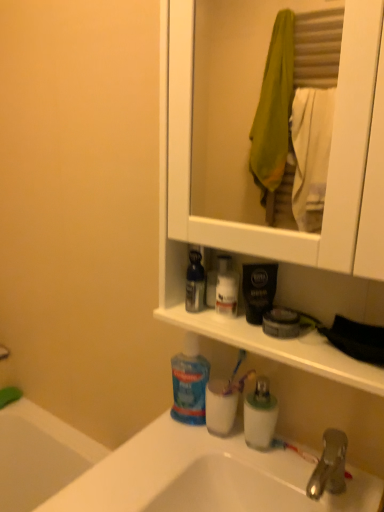
Question: Is blue glossy mouthwash at center, the second mouthwash viewed from the right, surrounded by white matte cabinet at upper center?

Choices:
 (A) no
 (B) yes

Answer: (B)

Question: Would you say white matte cabinet at upper center is outside blue glossy mouthwash at center, acting as the 2th mouthwash starting from the bottom?

Choices:
 (A) yes
 (B) no

Answer: (A)

Question: Is white matte cabinet at upper center next to blue glossy mouthwash at center, acting as the 2th mouthwash starting from the bottom?

Choices:
 (A) yes
 (B) no

Answer: (B)

Question: Does white matte cabinet at upper center have a lesser width compared to blue glossy mouthwash at center, acting as the 2th mouthwash starting from the bottom?

Choices:
 (A) yes
 (B) no

Answer: (B)

Question: From the image's perspective, is white matte cabinet at upper center above blue glossy mouthwash at center, placed as the first mouthwash when sorted from left to right?

Choices:
 (A) yes
 (B) no

Answer: (A)

Question: Is white matte cabinet at upper center at the left side of blue glossy mouthwash at center, the second mouthwash viewed from the right?

Choices:
 (A) yes
 (B) no

Answer: (B)

Question: From a real-world perspective, is white glossy lotion at center, which is counted as the 1th toiletry, starting from the left, positioned under blue glossy mouthwash at center, placed as the first mouthwash when sorted from left to right, based on gravity?

Choices:
 (A) no
 (B) yes

Answer: (B)

Question: Is white glossy lotion at center, which ranks as the first toiletry in top-to-bottom order, oriented towards blue glossy mouthwash at center, positioned as the first mouthwash in top-to-bottom order?

Choices:
 (A) no
 (B) yes

Answer: (A)

Question: Is white glossy lotion at center, which ranks as the first toiletry in top-to-bottom order, touching blue glossy mouthwash at center, placed as the first mouthwash when sorted from left to right?

Choices:
 (A) no
 (B) yes

Answer: (B)

Question: Is white glossy lotion at center, which ranks as the first toiletry in top-to-bottom order, completely or partially outside of blue glossy mouthwash at center, acting as the 2th mouthwash starting from the bottom?

Choices:
 (A) yes
 (B) no

Answer: (A)

Question: Can you confirm if white glossy lotion at center, the 2th toiletry from the right, is shorter than blue glossy mouthwash at center, the second mouthwash viewed from the right?

Choices:
 (A) yes
 (B) no

Answer: (B)

Question: Is white glossy lotion at center, which ranks as the first toiletry in top-to-bottom order, oriented away from blue glossy mouthwash at center, the second mouthwash viewed from the right?

Choices:
 (A) yes
 (B) no

Answer: (B)

Question: Is translucent plastic mouthwash at sink, which is the 1th mouthwash in bottom-to-top order, next to white glossy lotion at center, the second toiletry ordered from the bottom, and touching it?

Choices:
 (A) yes
 (B) no

Answer: (B)